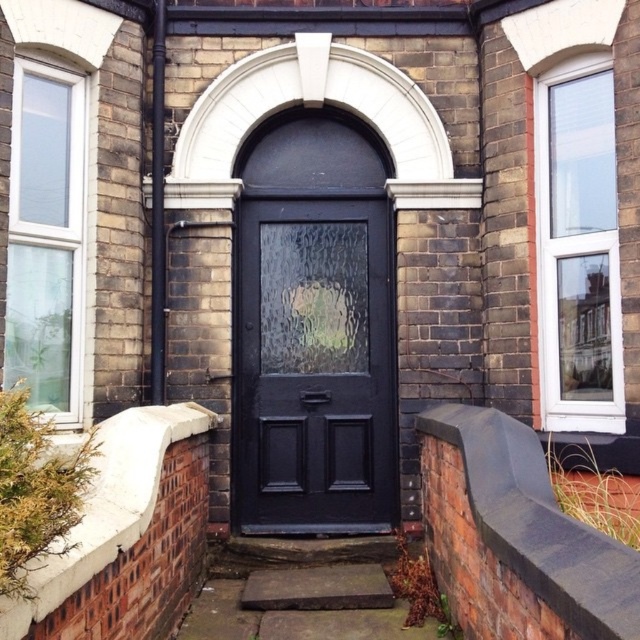
Question: Is matte black door at center below smooth concrete step at center?

Choices:
 (A) no
 (B) yes

Answer: (A)

Question: Which point is farther to the camera?

Choices:
 (A) matte black door at center
 (B) smooth concrete step at center

Answer: (A)

Question: From the image, what is the correct spatial relationship of matte black door at center in relation to smooth concrete step at center?

Choices:
 (A) above
 (B) below

Answer: (A)

Question: In this image, where is matte black door at center located relative to smooth concrete step at center?

Choices:
 (A) below
 (B) above

Answer: (B)